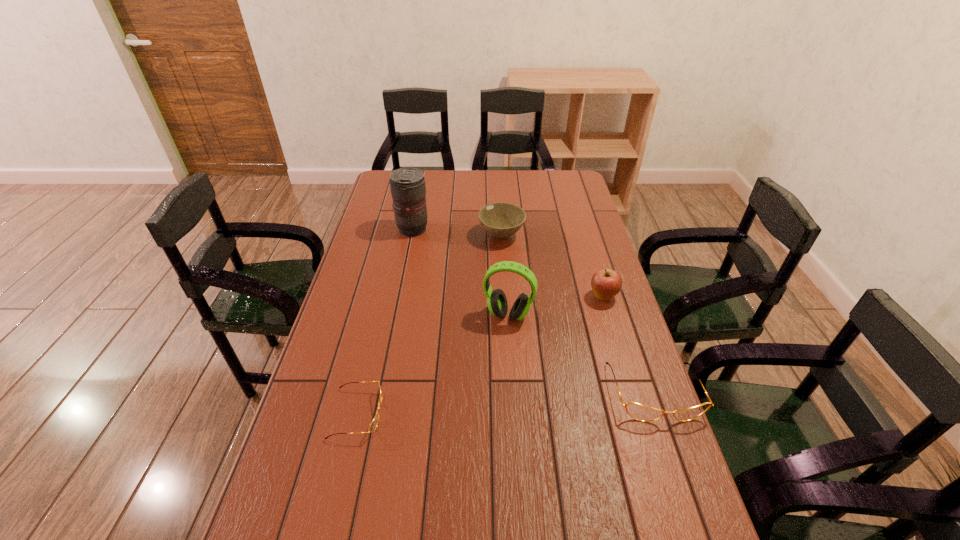
What are the coordinates of `free location located 0.230m on the side of the tallest object where the control switches are located` in the screenshot? It's located at (488, 230).

Where is `vacant space located 0.060m on the back of the apple`? This screenshot has width=960, height=540. vacant space located 0.060m on the back of the apple is located at coordinates (597, 275).

I want to click on free space located 0.340m on the front of the bowl, so pos(506,315).

You are a GUI agent. You are given a task and a screenshot of the screen. Output one action in this format:
    pyautogui.click(x=<x>, y=<y>)
    Task: Click on the vacant space located 0.310m on the left of the second tallest object
    The height and width of the screenshot is (540, 960).
    Given the screenshot: What is the action you would take?
    pyautogui.click(x=385, y=315)

Identify the location of spectacles at the left edge. (373, 425).

Locate an element on the screen. This screenshot has width=960, height=540. telephoto lens located in the left edge section of the desktop is located at coordinates (408, 189).

Find the location of a particular element. spectacles that is at the right edge is located at coordinates (637, 411).

Find the location of a particular element. The height and width of the screenshot is (540, 960). apple that is at the right edge is located at coordinates (606, 283).

The image size is (960, 540). Find the location of `free location at the far edge`. free location at the far edge is located at coordinates (506, 178).

The image size is (960, 540). Find the location of `vacant region at the near edge of the desktop`. vacant region at the near edge of the desktop is located at coordinates (380, 537).